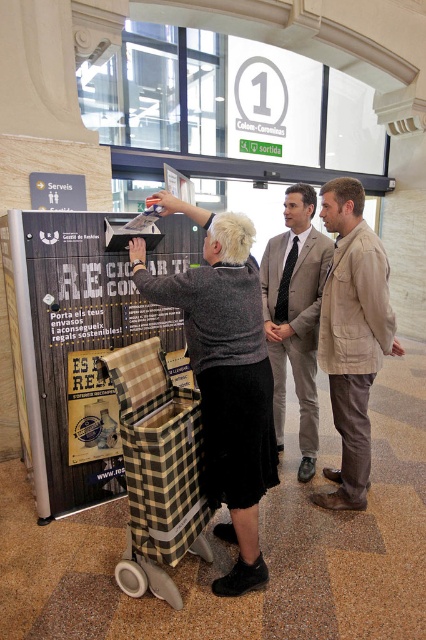
You are standing at the entrance of the Colom Corominas station and want to place a wooden plaid basket at center. What are the coordinates where you should place it?

The wooden plaid basket at center should be placed at coordinates (81, 349).